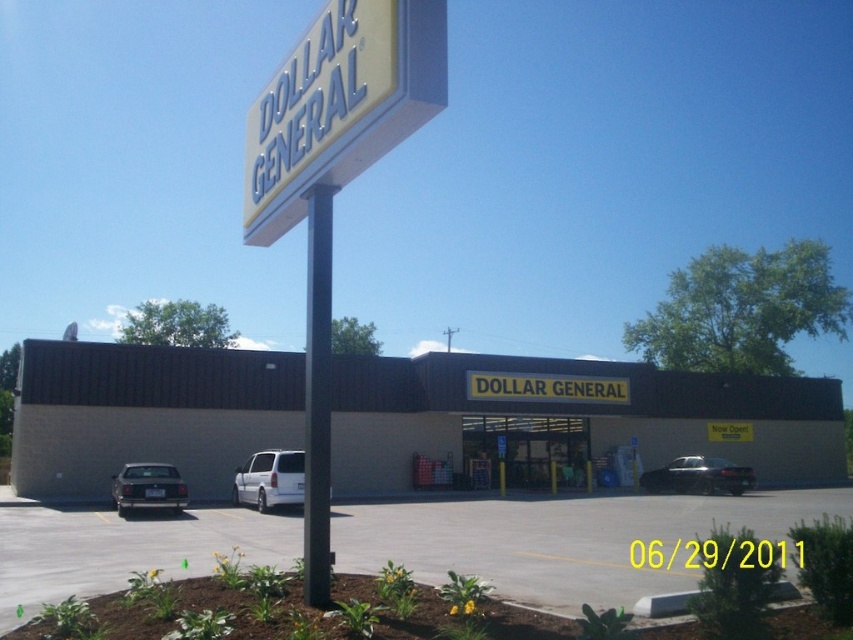
In the scene shown: Which of these two, black smooth pole at center or matte black sedan at lower left, stands shorter?

With less height is matte black sedan at lower left.

From the picture: Which is below, black smooth pole at center or matte black sedan at lower left?

matte black sedan at lower left is below.

Does point (308, 456) lie behind point (129, 497)?

No, it is in front of (129, 497).

Image resolution: width=853 pixels, height=640 pixels. I want to click on black smooth pole at center, so click(317, 396).

Is beige concrete building at center thinner than black smooth pole at center?

No, beige concrete building at center is not thinner than black smooth pole at center.

Between beige concrete building at center and black smooth pole at center, which one is positioned lower?

beige concrete building at center

The width and height of the screenshot is (853, 640). I want to click on beige concrete building at center, so click(x=576, y=417).

Does beige concrete building at center have a lesser height compared to white matte van at center?

No.

Does point (78, 428) come in front of point (287, 497)?

No, it is behind (287, 497).

Describe the element at coordinates (576, 417) in the screenshot. Image resolution: width=853 pixels, height=640 pixels. I see `beige concrete building at center` at that location.

Where is `beige concrete building at center`? The height and width of the screenshot is (640, 853). beige concrete building at center is located at coordinates (576, 417).